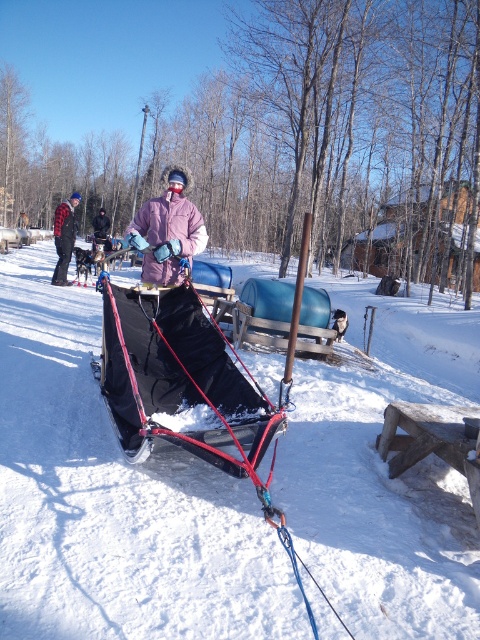
Question: Is white matte snow at center thinner than pink fleece jacket at center?

Choices:
 (A) no
 (B) yes

Answer: (A)

Question: Does white matte snow at center have a greater width compared to brushed metal jacket at left?

Choices:
 (A) no
 (B) yes

Answer: (B)

Question: Which point is closer to the camera?

Choices:
 (A) (181, 232)
 (B) (99, 218)
 (C) (151, 502)

Answer: (C)

Question: Can you confirm if white matte snow at center is smaller than pink fleece jacket at center?

Choices:
 (A) yes
 (B) no

Answer: (B)

Question: Which of the following is the closest to the observer?

Choices:
 (A) (106, 221)
 (B) (375, 518)
 (C) (60, 227)
 (D) (175, 225)

Answer: (B)

Question: Which of these objects is positioned farthest from the pink fuzzy jacket at center?

Choices:
 (A) pink fleece jacket at center
 (B) white matte snow at center
 (C) brushed metal jacket at left

Answer: (A)